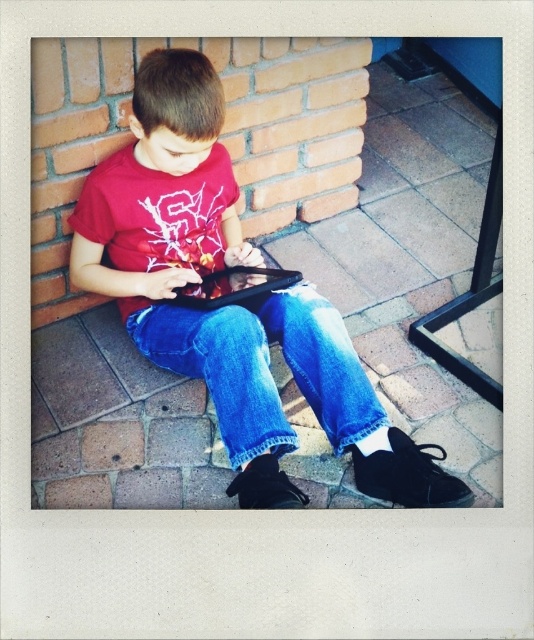
You are a drone operator trying to deliver a small package to a specific location in the image. The delivery must be made to either point (265, 436) or point (208, 275). However, due to safety regulations, you can only deliver to the point that is closer to the viewer. Which point should you choose?

Point (265, 436) is closer to the viewer than point (208, 275), so you should deliver to point (265, 436).

You are a photographer trying to capture the boy and his tablet. You notice the matte black tablet at center and the denim at center. Which object should you focus on first to ensure both are in focus?

The matte black tablet at center is closer to the viewer than the denim at center. To ensure both are in focus, you should focus on the matte black tablet at center first since it is closer, allowing the denim at center to fall within the depth of field.

You are a photographer taking a picture of the boy. You want to ensure both the matte black tablet at center and the denim at center are clearly visible in the frame. Which object should you position closer to the left side of the camera frame?

The matte black tablet at center is positioned on the left side of denim at center, so to have both objects clearly visible, position the matte black tablet at center closer to the left side of the camera frame.